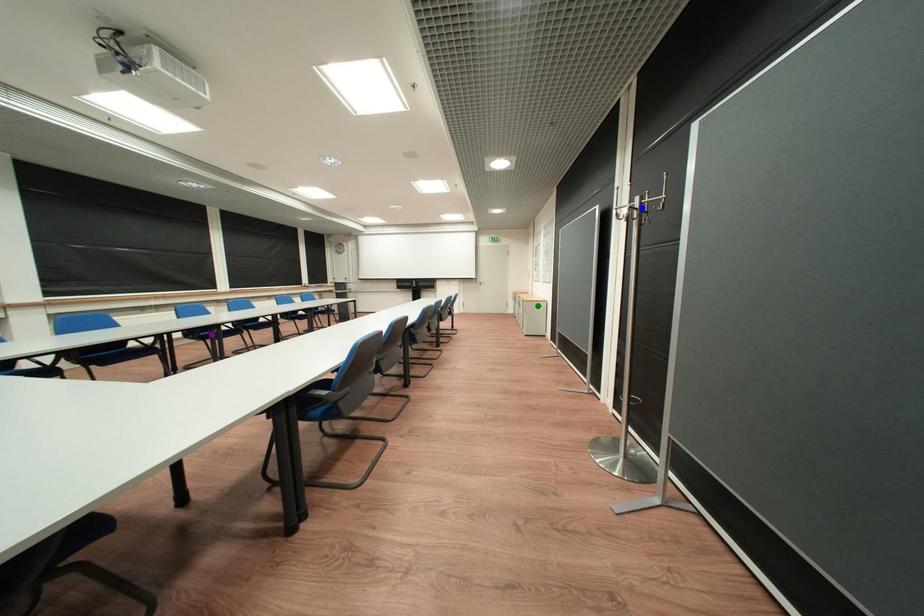
Based on the photo, order these from nearest to farthest:
blue point
purple point
green point

blue point → purple point → green point